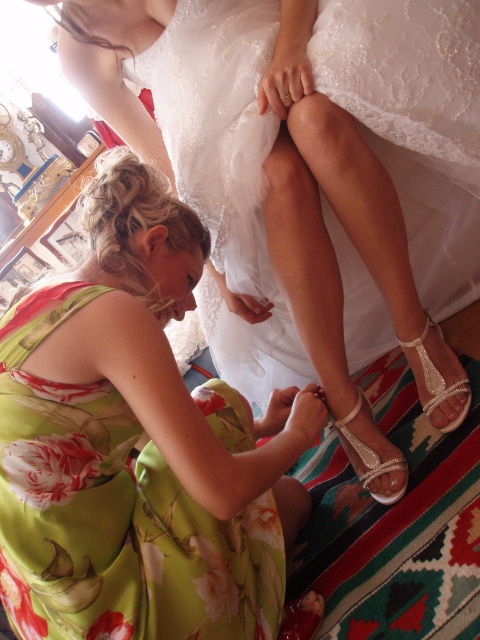
Question: Which point appears closest to the camera in this image?

Choices:
 (A) (92, 333)
 (B) (286, 609)

Answer: (A)

Question: In this image, where is green floral dress at lower left located relative to clear crystal sandal at lower center?

Choices:
 (A) left
 (B) right

Answer: (A)

Question: Which of these objects is positioned closest to the green floral dress at lower left?

Choices:
 (A) satin white sandal at lower center
 (B) clear crystal sandal at lower right

Answer: (A)

Question: Which object is the farthest from the clear crystal sandal at lower center?

Choices:
 (A) satin white sandal at lower center
 (B) green floral dress at lower left
 (C) white lace dress at center
 (D) clear crystal sandal at lower right

Answer: (C)

Question: Can you confirm if white lace dress at center is positioned to the left of satin white sandal at lower center?

Choices:
 (A) no
 (B) yes

Answer: (A)

Question: Observing the image, what is the correct spatial positioning of clear crystal sandal at lower right in reference to clear crystal sandal at lower center?

Choices:
 (A) below
 (B) above

Answer: (B)